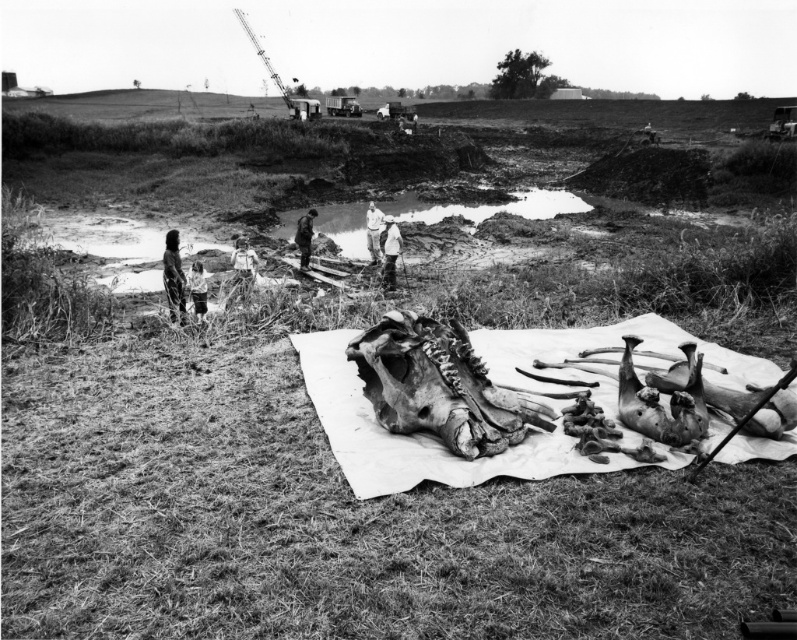
You are standing at the excavation site and want to take a photo of both the animal skull and the group of researchers. Which point, point (497,353) or point (250,264), is closer to your camera position?

Point (497,353) is closer to the camera than point (250,264), so you should position your camera closer to that point to capture both the animal skull and the group of researchers effectively.

You are an archaeologist at the excavation site. You need to cover the smooth skin child at center with the white cloth at center. Is the cloth large enough to fully cover the child?

The white cloth at center is larger in size than smooth skin child at center, so yes, the cloth is large enough to fully cover the smooth skin child at center.

You are observing the excavation site from above. Which object is closer to you between the light brown leather jacket at lower left and the light skin tone human at center?

The light brown leather jacket at lower left is closer to you because it is in front of the light skin tone human at center.